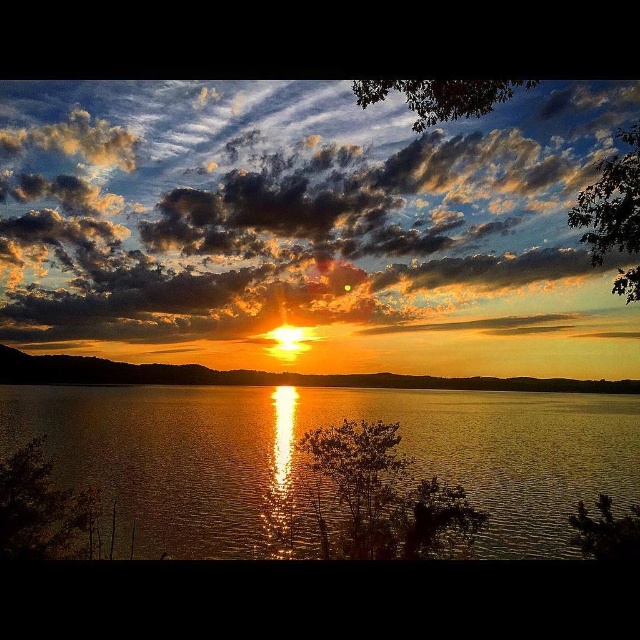
You are an artist trying to paint the sunset scene. You need to decide where to place the cloudy sky at upper center and the golden matte horizon at center. According to the scene, which object is above the other?

The cloudy sky at upper center is positioned over the golden matte horizon at center, meaning it is above it.

You are standing on the edge of the water and want to throw a stone to hit both the cloudy sky at upper center and the reflection of the sun on the water. What should you aim for?

You should aim for the reflection of the sun on the water because the cloudy sky at upper center is 17.96 meters away from it, making it possible to hit both with one throw if you calculate the trajectory correctly.

You are standing on the shore of the lake and looking towards the horizon. Which object, the cloudy sky at upper center or the glistening reflective water at center, is positioned to the left of the other?

The cloudy sky at upper center is to the left of the glistening reflective water at center.